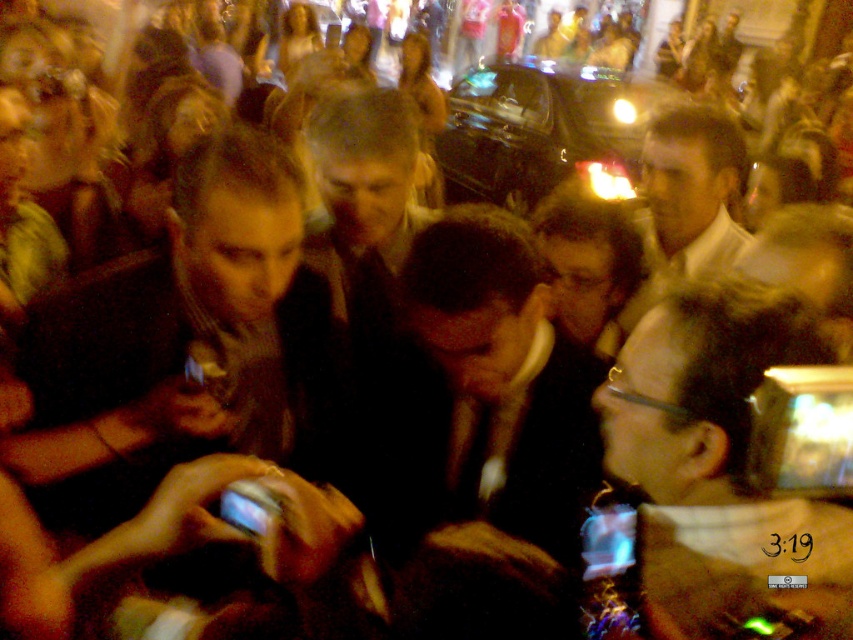
Between clear plastic phone at right and matte white shirt at center, which one has less height?

Standing shorter between the two is clear plastic phone at right.

Can you confirm if clear plastic phone at right is smaller than matte white shirt at center?

Correct, clear plastic phone at right occupies less space than matte white shirt at center.

Which is behind, point (663, 464) or point (735, 225)?

The point (735, 225) is behind.

At what (x,y) coordinates should I click in order to perform the action: click on clear plastic phone at right. Please return your answer as a coordinate pair (x, y). The height and width of the screenshot is (640, 853). Looking at the image, I should click on (718, 465).

Is dark brown leather jacket at left taller than clear plastic phone at right?

Yes.

Does dark brown leather jacket at left have a lesser width compared to clear plastic phone at right?

No, dark brown leather jacket at left is not thinner than clear plastic phone at right.

Find the location of a particular element. The height and width of the screenshot is (640, 853). dark brown leather jacket at left is located at coordinates (173, 333).

Is dark brown leather jacket at left in front of matte white shirt at center?

Yes.

Is point (45, 410) less distant than point (717, 253)?

Yes, it is.

Where is `dark brown leather jacket at left`? The width and height of the screenshot is (853, 640). dark brown leather jacket at left is located at coordinates (173, 333).